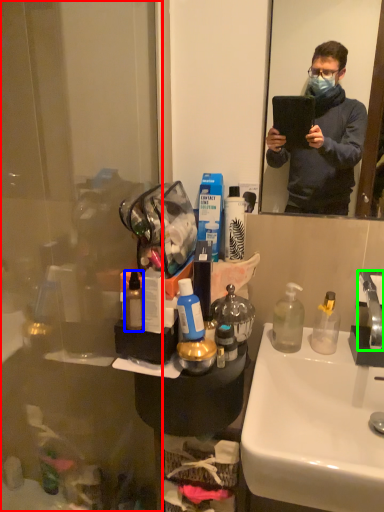
Question: Which object is the farthest from glass door (highlighted by a red box)? Choose among these: toiletries (highlighted by a blue box) or faucet (highlighted by a green box).

Choices:
 (A) toiletries
 (B) faucet

Answer: (B)